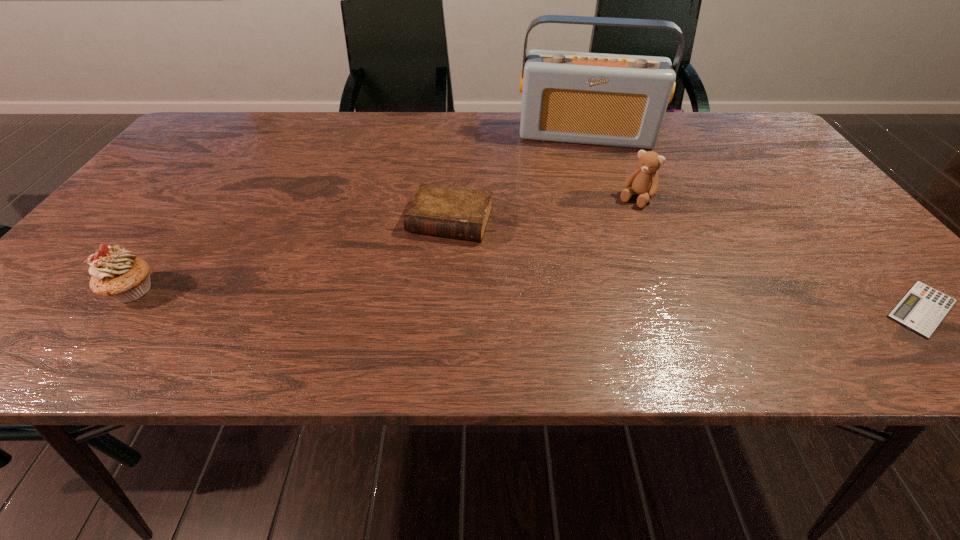
You are a GUI agent. You are given a task and a screenshot of the screen. Output one action in this format:
    pyautogui.click(x=<x>, y=<y>)
    Task: Click on the free space that is in between the teddy bear and the leftmost object
    The width and height of the screenshot is (960, 540).
    Given the screenshot: What is the action you would take?
    pyautogui.click(x=384, y=245)

Locate an element on the screen. This screenshot has height=540, width=960. free space between the second shortest object and the teddy bear is located at coordinates (543, 210).

Locate an element on the screen. Image resolution: width=960 pixels, height=540 pixels. blank region between the teddy bear and the radio receiver is located at coordinates (611, 167).

In order to click on vacant region between the diary and the radio receiver in this screenshot , I will do `click(518, 178)`.

Identify which object is the third nearest to the calculator. Please provide its 2D coordinates. Your answer should be formatted as a tuple, i.e. [(x, y)], where the tuple contains the x and y coordinates of a point satisfying the conditions above.

[(462, 213)]

Locate an element on the screen. object that is the second closest to the calculator is located at coordinates (617, 100).